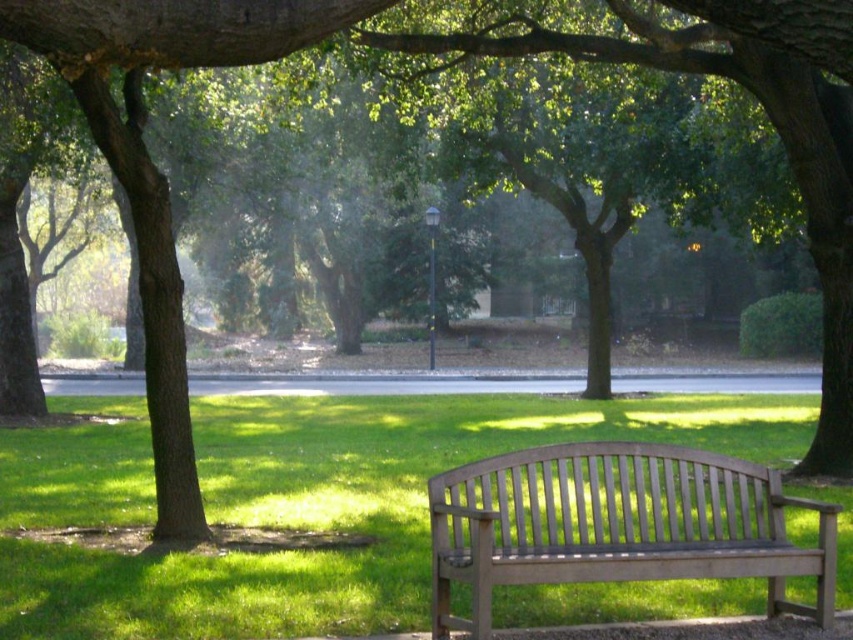
Is point (6, 433) farther from camera compared to point (459, 497)?

That is True.

Which of these two, green grass at center or light brown wooden bench at center, stands taller?

light brown wooden bench at center

Find the location of `green grass at center`. green grass at center is located at coordinates (343, 508).

You are a GUI agent. You are given a task and a screenshot of the screen. Output one action in this format:
    pyautogui.click(x=<x>, y=<y>)
    Task: Click on the green grass at center
    The image size is (853, 640).
    Given the screenshot: What is the action you would take?
    pyautogui.click(x=343, y=508)